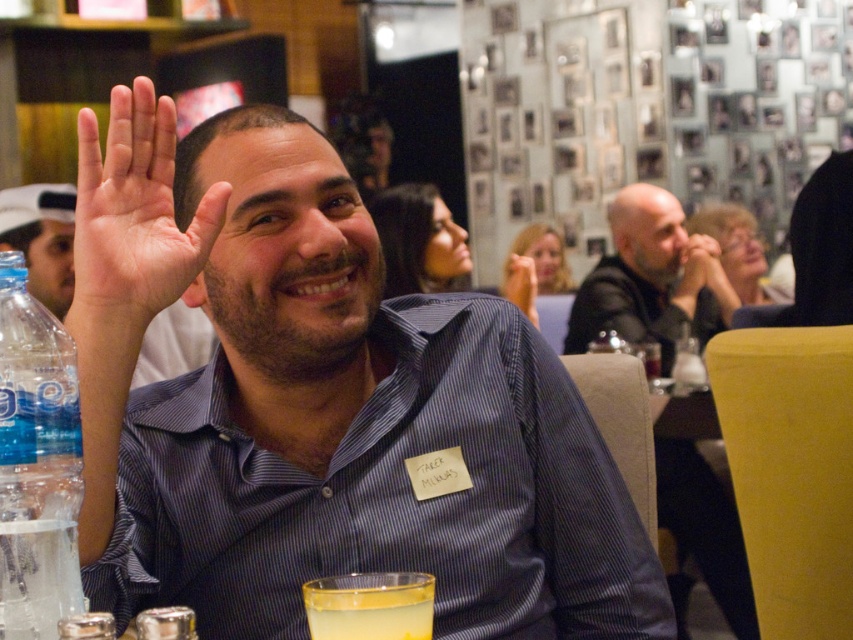
Question: Is blue striped shirt at center closer to camera compared to matte black hand at upper center?

Choices:
 (A) yes
 (B) no

Answer: (A)

Question: Which object is farther from the camera taking this photo?

Choices:
 (A) matte black hand at upper center
 (B) matte skin hand at center
 (C) dark gray shirt at center
 (D) yellow plastic table at lower right

Answer: (B)

Question: Estimate the real-world distances between objects in this image. Which object is farther from the matte black shirt at center?

Choices:
 (A) smooth black jacket at upper right
 (B) yellow translucent liquid at lower center
 (C) matte black hand at upper center
 (D) yellow plastic table at lower right

Answer: (B)

Question: Which object is positioned farthest from the yellow plastic table at lower right?

Choices:
 (A) white matte hand at upper center
 (B) matte black hand at upper center
 (C) matte skin hand at center

Answer: (A)

Question: Is dark gray shirt at center positioned behind white matte hand at upper center?

Choices:
 (A) no
 (B) yes

Answer: (B)

Question: Is blue striped shirt at center to the right of yellow plastic table at lower right from the viewer's perspective?

Choices:
 (A) yes
 (B) no

Answer: (B)